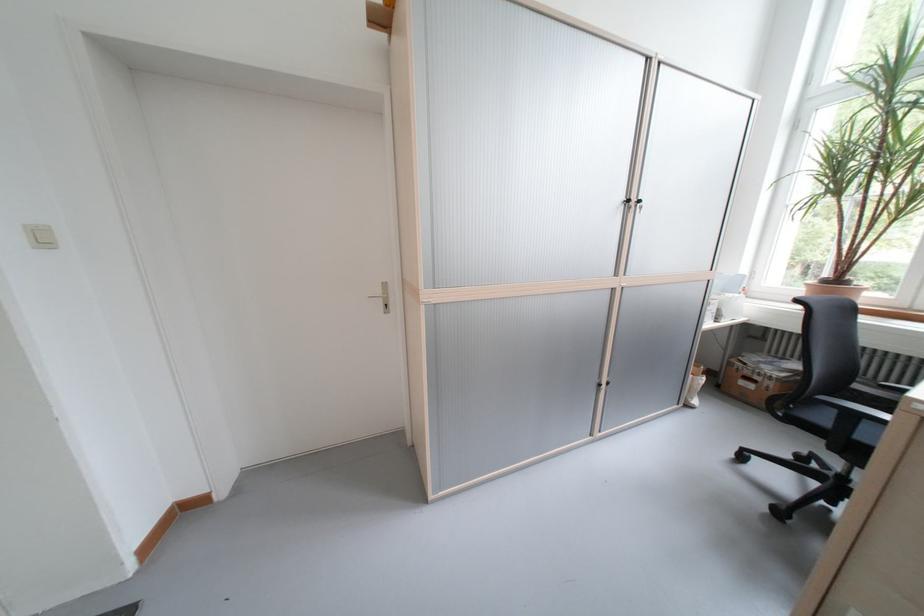
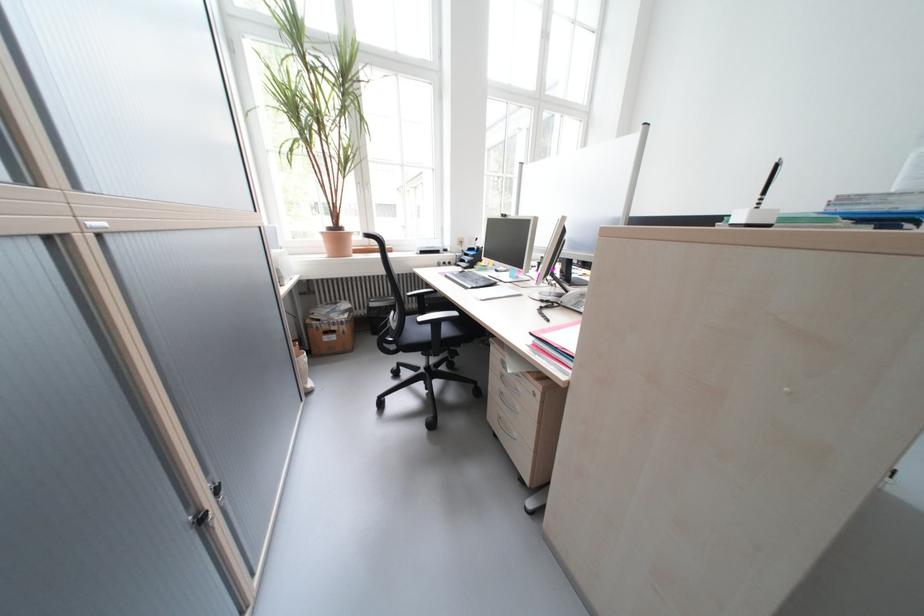
Locate, in the second image, the point that corresponds to pixel 833 399 in the first image.

(431, 320)